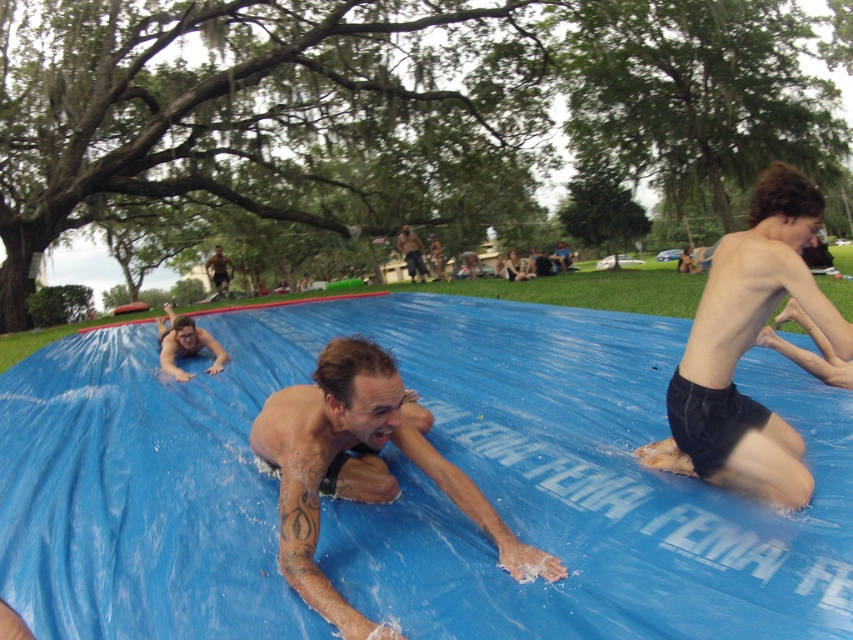
You are a photographer trying to capture the best shot of the black matte shorts at center and the tattooed skin at center. Which object should you zoom in on to ensure it takes up more of your camera frame?

The tattooed skin at center occupies more space than the black matte shorts at center, so zooming in on the tattooed skin at center will ensure it takes up more of the camera frame.

You are a photographer trying to capture the man at the center of the slide. Which part of his body should you focus on if you want to highlight the tattooed skin at center without including the black matte shorts at center in the frame?

The tattooed skin at center is on the left side of the black matte shorts at center. To focus on the tattooed skin at center without including the black matte shorts at center, aim for the left side of the man.